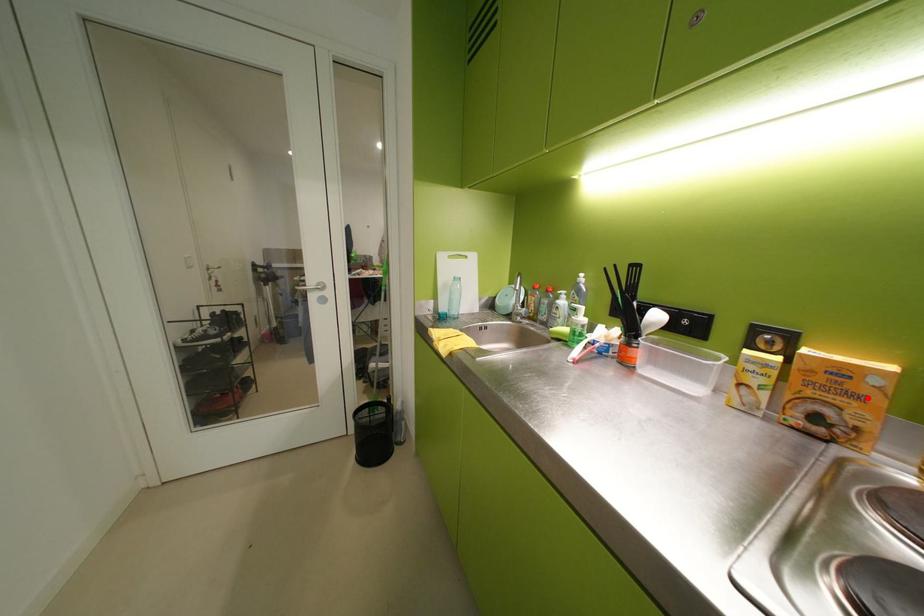
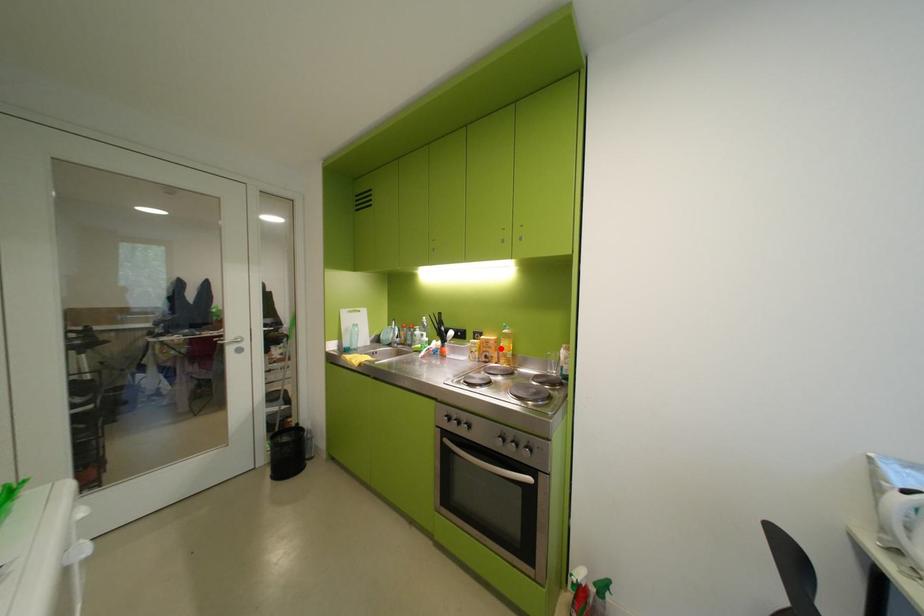
I am providing you with two images of the same scene from different viewpoints. A red point is marked on the first image and another point is marked on the second image. Do the highlighted points in image1 and image2 indicate the same real-world spot?

Yes